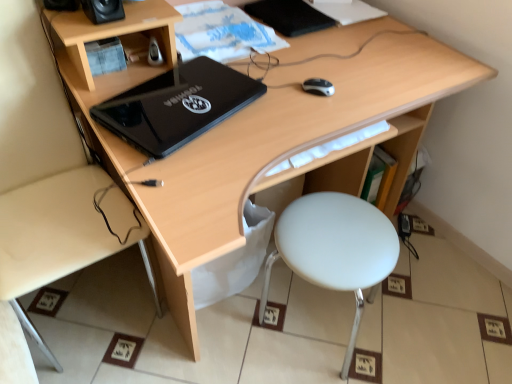
Find the location of a particular element. This screenshot has height=384, width=512. free space to the right of black matte speaker at upper left, the second speaker viewed from the left is located at coordinates (148, 12).